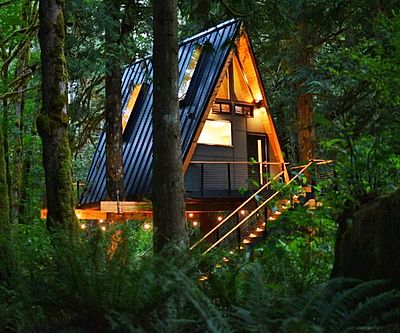
You are a GUI agent. You are given a task and a screenshot of the screen. Output one action in this format:
    pyautogui.click(x=<x>, y=<y>)
    Task: Click on the large window light coming in
    This screenshot has width=400, height=333.
    Given the screenshot: What is the action you would take?
    pyautogui.click(x=210, y=134)